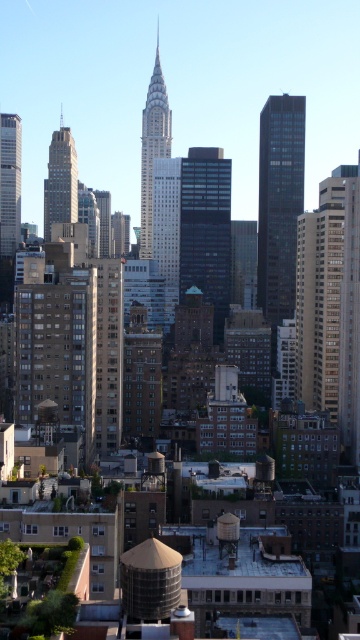
Question: Which point appears closest to the camera in this image?

Choices:
 (A) pyautogui.click(x=326, y=236)
 (B) pyautogui.click(x=68, y=161)

Answer: (A)

Question: Does dark glass skyscraper at upper right have a larger size compared to shiny silver skyscraper at center?

Choices:
 (A) no
 (B) yes

Answer: (B)

Question: Is gold glass skyscraper at center positioned in front of matte glass skyscraper at left?

Choices:
 (A) no
 (B) yes

Answer: (B)

Question: Is dark glass skyscraper at upper right smaller than matte brown building at left?

Choices:
 (A) yes
 (B) no

Answer: (B)

Question: Which object appears closest to the camera in this image?

Choices:
 (A) dark glass skyscraper at upper right
 (B) shiny silver skyscraper at center
 (C) gold glass skyscraper at center
 (D) matte glass skyscraper at left

Answer: (C)

Question: Estimate the real-world distances between objects in this image. Which object is farther from the shiny silver skyscraper at center?

Choices:
 (A) dark glass skyscraper at upper right
 (B) matte glass skyscraper at left
 (C) matte brown building at left
 (D) gold glass skyscraper at center

Answer: (D)